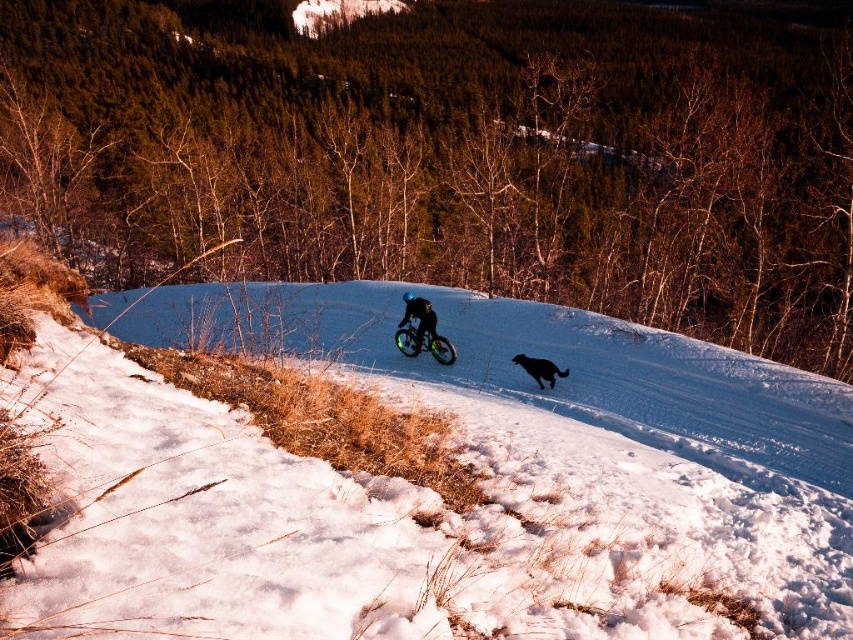
You are trying to decide whether to carry the shiny black jacket at center on your back while riding the green rubber mountain bike at center. Based on their sizes, will the jacket be visible behind you?

The green rubber mountain bike at center is larger in size than the shiny black jacket at center, so the jacket will likely be mostly or entirely obscured by the bike when carried on your back.

You are standing at the camera position and want to estimate how far the shiny black jacket at center is from you. Based on the scene, can you provide an approximate distance?

The shiny black jacket at center is approximately 20.90 meters away from the camera position.

You are a photographer standing in the forest and want to take a photo of the shiny black jacket at center and the black fur dog at center. Which object should you focus on first to ensure both are in focus?

You should focus on the shiny black jacket at center first because it is closer to you than the black fur dog at center, so focusing on the closer object will help ensure both are in focus.